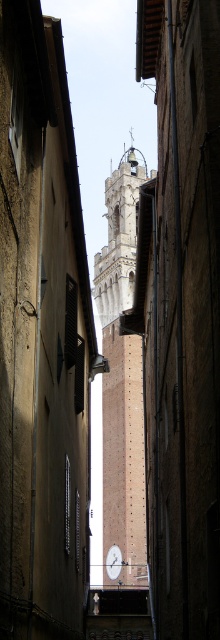
You are a delivery person trying to navigate through the narrow alleyway. You see the beige stone bell tower at center and the white glossy clock at center. Which object is positioned higher up in the scene?

The beige stone bell tower at center is above the white glossy clock at center, so it is positioned higher up in the scene.

In the scene shown: You are standing in the alleyway and see the point marked at coordinates (119,236). What does this point indicate?

The point at (119,236) marks the location of the beige stone bell tower at center.